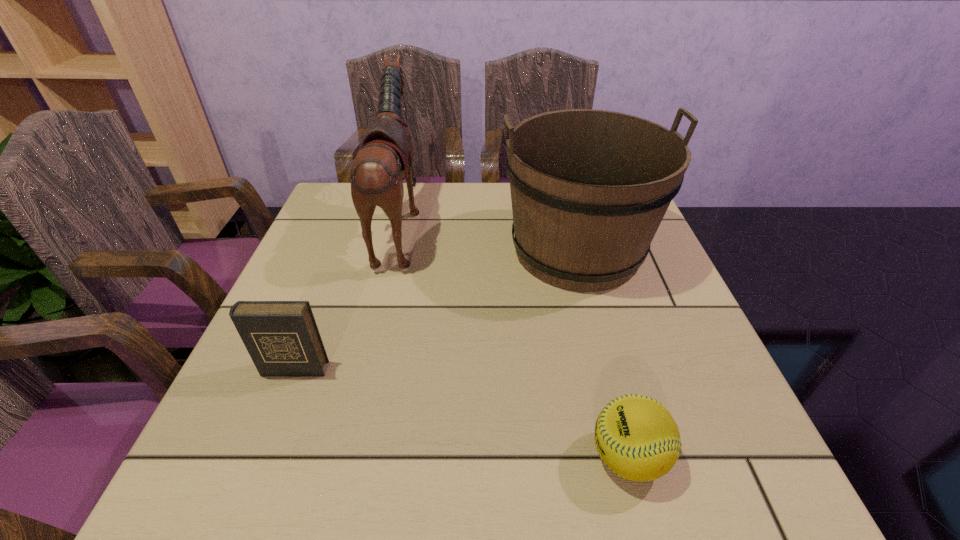
Locate an element on the screen. The image size is (960, 540). vacant space that satisfies the following two spatial constraints: 1. on the back of the third object from right to left; 2. on the back side of the bucket is located at coordinates (394, 251).

Where is `free space that satisfies the following two spatial constraints: 1. on the back of the third object from right to left; 2. on the front cover of the leftmost object`? Image resolution: width=960 pixels, height=540 pixels. free space that satisfies the following two spatial constraints: 1. on the back of the third object from right to left; 2. on the front cover of the leftmost object is located at coordinates (365, 369).

The image size is (960, 540). Find the location of `vacant position in the image that satisfies the following two spatial constraints: 1. on the back of the saddle; 2. on the front cover of the diary`. vacant position in the image that satisfies the following two spatial constraints: 1. on the back of the saddle; 2. on the front cover of the diary is located at coordinates pos(365,369).